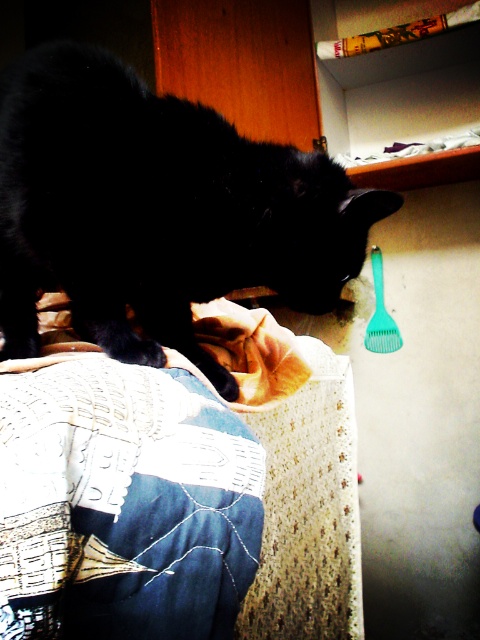
You are a pet groomer who needs to reach the green plastic brush at upper right to groom the black fur cat at left. The brush is on a high shelf. Can you safely reach it without disturbing the cat?

The black fur cat at left and green plastic brush at upper right are 3.49 feet apart. Since the distance between them is over 3 feet, you can safely reach the green plastic brush at upper right without disturbing the black fur cat at left.

You are a pet sitter who needs to place a small toy between the black fur cat at left and the embroidered denim jeans at lower left. Can you fit it there?

The black fur cat at left and the embroidered denim jeans at lower left are 9.46 inches apart. Since the toy is small, it can easily fit in the space between them.

You are a photographer trying to capture a clear shot of the black fur cat at left and the green plastic brush at upper right. Which object should you focus on first to ensure both are in focus?

You should focus on the black fur cat at left first because it is closer to the viewer than the green plastic brush at upper right, so adjusting focus from near to far will help both be in focus.